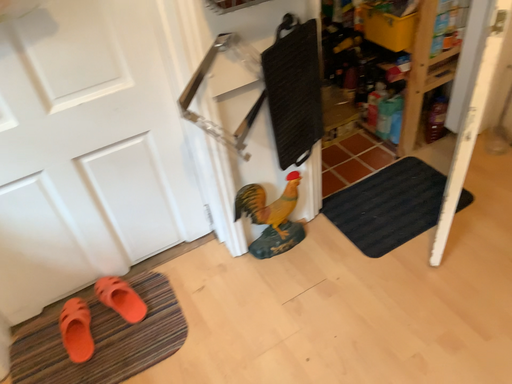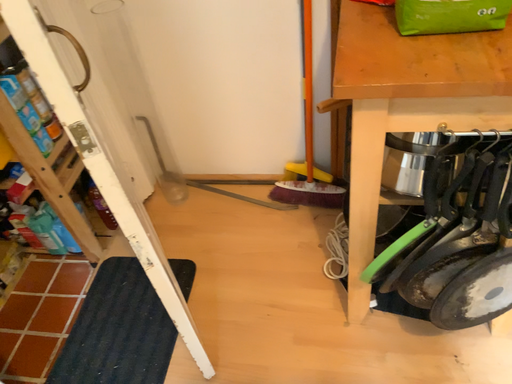
Question: How did the camera likely rotate when shooting the video?

Choices:
 (A) rotated upward
 (B) rotated downward

Answer: (A)